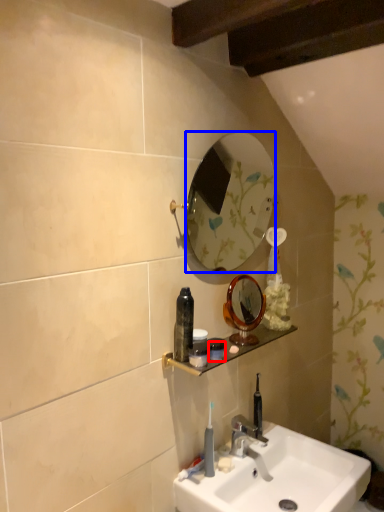
Question: Which point is further to the camera, toiletry (highlighted by a red box) or mirror (highlighted by a blue box)?

Choices:
 (A) toiletry
 (B) mirror

Answer: (A)